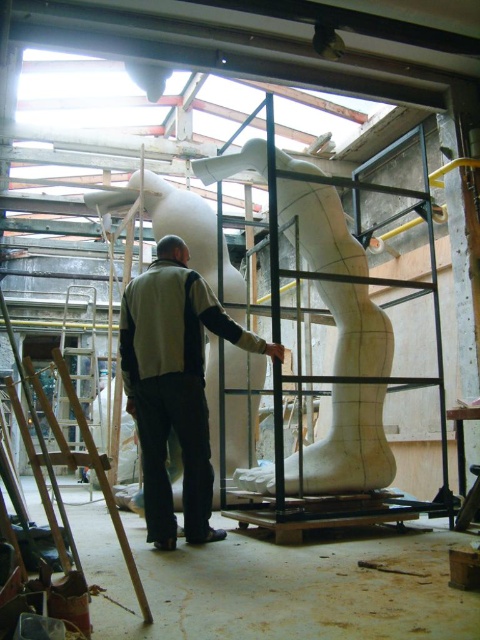
Who is taller, light gray fabric jacket at center or metallic silver ladder at left?

metallic silver ladder at left is taller.

Which is behind, point (194, 312) or point (95, 381)?

Positioned behind is point (95, 381).

At what (x,y) coordinates should I click in order to perform the action: click on light gray fabric jacket at center. Please return your answer as a coordinate pair (x, y). The image size is (480, 640). Looking at the image, I should click on (175, 385).

Between point (173, 253) and point (308, 164), which one is positioned behind?

The point (308, 164) is behind.

Measure the distance from light gray fabric jacket at center to white marble sculpture at center.

light gray fabric jacket at center is 24.11 inches from white marble sculpture at center.

Which is in front, point (203, 477) or point (388, 330)?

Positioned in front is point (203, 477).

The image size is (480, 640). I want to click on light gray fabric jacket at center, so 175,385.

Can you confirm if white marble sculpture at center is positioned to the left of metallic silver ladder at left?

In fact, white marble sculpture at center is to the right of metallic silver ladder at left.

Is point (290, 166) closer to viewer compared to point (80, 442)?

Yes, point (290, 166) is closer to viewer.

Where is `white marble sculpture at center`? white marble sculpture at center is located at coordinates (350, 444).